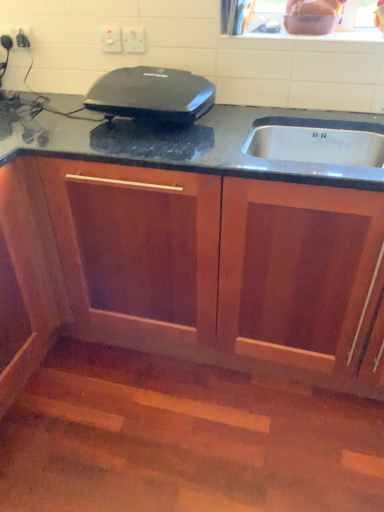
Question: Based on their sizes in the image, would you say wooden cabinet at center is bigger or smaller than white plastic electric outlet at upper center, acting as the 2th electric outlet starting from the left?

Choices:
 (A) big
 (B) small

Answer: (A)

Question: In the image, is wooden cabinet at center positioned in front of or behind white plastic electric outlet at upper center, placed as the first electric outlet when sorted from right to left?

Choices:
 (A) behind
 (B) front

Answer: (B)

Question: Based on their relative distances, which object is farther from the black glossy waffle maker at center?

Choices:
 (A) white plastic electric outlet at upper center, the first electric outlet from the left
 (B) wooden cabinet at center
 (C) metallic silver toaster at upper left
 (D) white plastic electric outlet at upper center, acting as the 2th electric outlet starting from the left

Answer: (C)

Question: Considering the real-world distances, which object is farthest from the white plastic electric outlet at upper center, placed as the first electric outlet when sorted from right to left?

Choices:
 (A) metallic silver toaster at upper left
 (B) wooden cabinet at center
 (C) black glossy waffle maker at center
 (D) white plastic electric outlet at upper center, the first electric outlet from the left

Answer: (B)